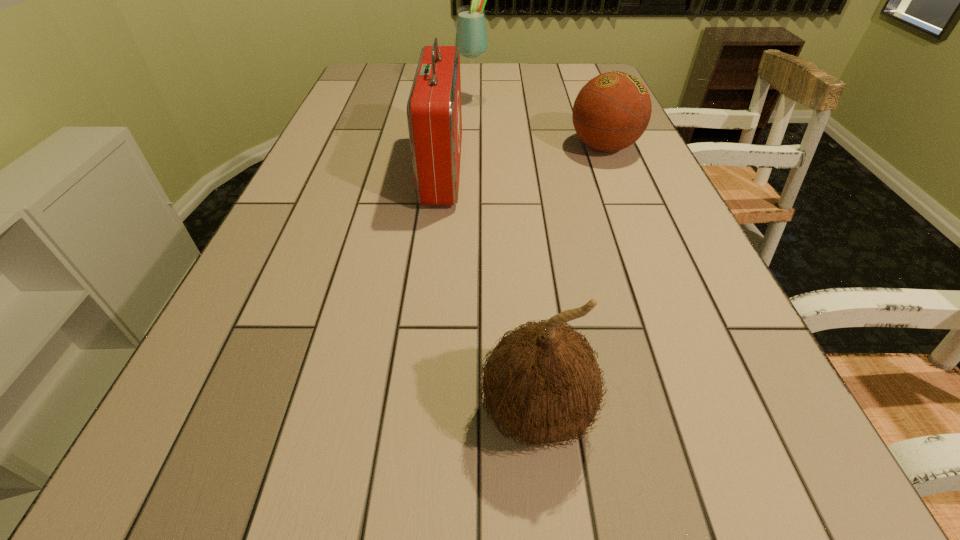
Identify the location of alcohol. The height and width of the screenshot is (540, 960). (471, 36).

Locate an element on the screen. The height and width of the screenshot is (540, 960). the first-aid kit is located at coordinates (434, 115).

Identify the location of the nearest object. (542, 384).

Locate an element on the screen. the second shortest object is located at coordinates (542, 384).

Find the location of a particular element. The height and width of the screenshot is (540, 960). the rightmost object is located at coordinates tap(611, 112).

Find the location of a particular element. This screenshot has width=960, height=540. basketball is located at coordinates (611, 112).

The width and height of the screenshot is (960, 540). What are the coordinates of `vacant space located 0.110m on the right of the farthest object` in the screenshot? It's located at (525, 100).

Find the location of a particular element. The width and height of the screenshot is (960, 540). vacant space situated on the side of the first-aid kit with the first aid cross symbol is located at coordinates (603, 171).

This screenshot has width=960, height=540. I want to click on vacant region located on the front of the shortest object, so click(655, 276).

Locate an element on the screen. object positioned at the right edge is located at coordinates (611, 112).